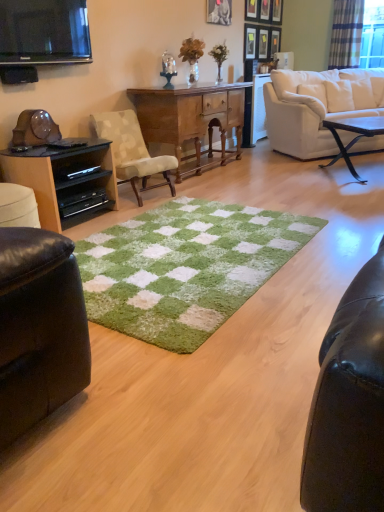
This screenshot has width=384, height=512. Describe the element at coordinates (277, 11) in the screenshot. I see `wooden picture frame at upper center, which is the 2th picture frame from right to left` at that location.

The image size is (384, 512). I want to click on wooden picture frame at upper center, which is the 2th picture frame from right to left, so click(277, 11).

This screenshot has width=384, height=512. Find the location of `wooden picture frame at upper center, placed as the third picture frame when sorted from right to left`. wooden picture frame at upper center, placed as the third picture frame when sorted from right to left is located at coordinates (263, 44).

Where is `beige fabric chair at center`? This screenshot has height=512, width=384. beige fabric chair at center is located at coordinates (131, 150).

What is the approximate width of beige fabric chair at center?

It is 22.84 inches.

What are the coordinates of `wooden picture frame at upper center, which is the 4th picture frame from right to left` in the screenshot? It's located at (265, 9).

Where is `wooden picture frame at upper center, which is the 2th picture frame from right to left`? The width and height of the screenshot is (384, 512). wooden picture frame at upper center, which is the 2th picture frame from right to left is located at coordinates (277, 11).

Is plaid fabric curtain at upper right shorter than metallic silver picture frame at upper center, the 1th picture frame in the right-to-left sequence?

In fact, plaid fabric curtain at upper right may be taller than metallic silver picture frame at upper center, the 1th picture frame in the right-to-left sequence.

From a real-world perspective, is plaid fabric curtain at upper right located higher than metallic silver picture frame at upper center, the seventh picture frame viewed from the left?

Correct, in the physical world, plaid fabric curtain at upper right is higher than metallic silver picture frame at upper center, the seventh picture frame viewed from the left.

Considering the sizes of objects plaid fabric curtain at upper right and metallic silver picture frame at upper center, the 1th picture frame in the right-to-left sequence, in the image provided, who is thinner, plaid fabric curtain at upper right or metallic silver picture frame at upper center, the 1th picture frame in the right-to-left sequence,?

Thinner between the two is metallic silver picture frame at upper center, the 1th picture frame in the right-to-left sequence.

Considering their positions, is plaid fabric curtain at upper right located in front of or behind metallic silver picture frame at upper center, the 1th picture frame in the right-to-left sequence?

Visually, plaid fabric curtain at upper right is located in front of metallic silver picture frame at upper center, the 1th picture frame in the right-to-left sequence.

From a real-world perspective, which object rests below the other?

green fuzzy vase at upper center, the 1th houseplant viewed from the right, is physically lower.

From the image's perspective, is metallic silver picture frame at upper center, the 1th picture frame in the right-to-left sequence, on green fuzzy vase at upper center, the 1th houseplant viewed from the right?

Yes, from the image's perspective, metallic silver picture frame at upper center, the 1th picture frame in the right-to-left sequence, is on top of green fuzzy vase at upper center, the 1th houseplant viewed from the right.

Is metallic silver picture frame at upper center, the 1th picture frame in the right-to-left sequence, not near green fuzzy vase at upper center, the second houseplant when ordered from left to right?

Indeed, metallic silver picture frame at upper center, the 1th picture frame in the right-to-left sequence, is not near green fuzzy vase at upper center, the second houseplant when ordered from left to right.

Consider the image. Between metallic silver picture frame at upper center, the 1th picture frame in the right-to-left sequence, and green fuzzy vase at upper center, the second houseplant when ordered from left to right, which one appears on the right side from the viewer's perspective?

From the viewer's perspective, metallic silver picture frame at upper center, the 1th picture frame in the right-to-left sequence, appears more on the right side.

In terms of width, does wooden picture frame at upper center, which is the 2th picture frame from right to left, look wider or thinner when compared to black glossy entertainment center at left?

Clearly, wooden picture frame at upper center, which is the 2th picture frame from right to left, has less width compared to black glossy entertainment center at left.

From the image's perspective, between wooden picture frame at upper center, which is the sixth picture frame from left to right, and black glossy entertainment center at left, which one is located above?

From the image's view, wooden picture frame at upper center, which is the sixth picture frame from left to right, is above.

Between wooden picture frame at upper center, which is the sixth picture frame from left to right, and black glossy entertainment center at left, which one has less height?

Standing shorter between the two is wooden picture frame at upper center, which is the sixth picture frame from left to right.

How many degrees apart are the facing directions of wooden picture frame at upper center, which is the 2th picture frame from right to left, and black glossy entertainment center at left?

The angular difference between wooden picture frame at upper center, which is the 2th picture frame from right to left, and black glossy entertainment center at left is 3.37 degrees.

Is beige fabric chair at center inside or outside of metallic silver picture frame at upper center, the first picture frame positioned from the left?

beige fabric chair at center cannot be found inside metallic silver picture frame at upper center, the first picture frame positioned from the left.

Could you measure the distance between beige fabric chair at center and metallic silver picture frame at upper center, the first picture frame positioned from the left?

The distance of beige fabric chair at center from metallic silver picture frame at upper center, the first picture frame positioned from the left, is 1.85 meters.

Is there a large distance between beige fabric chair at center and metallic silver picture frame at upper center, acting as the 7th picture frame starting from the right?

beige fabric chair at center is positioned a significant distance from metallic silver picture frame at upper center, acting as the 7th picture frame starting from the right.

Does beige fabric chair at center turn towards metallic silver picture frame at upper center, the first picture frame positioned from the left?

No, beige fabric chair at center is not turned towards metallic silver picture frame at upper center, the first picture frame positioned from the left.

From the image's perspective, is green fuzzy plant at upper center, which is the first houseplant in left-to-right order, located above flat screen tv at upper left?

Correct, green fuzzy plant at upper center, which is the first houseplant in left-to-right order, appears higher than flat screen tv at upper left in the image.

Can you tell me how much green fuzzy plant at upper center, the second houseplant when ordered from right to left, and flat screen tv at upper left differ in facing direction?

green fuzzy plant at upper center, the second houseplant when ordered from right to left, and flat screen tv at upper left are facing 2.01 degrees away from each other.

I want to click on the 1st houseplant above the flat screen tv at upper left (from the image's perspective), so click(192, 56).

Between point (274, 38) and point (260, 2), which one is positioned behind?

The point (274, 38) is farther.

Does metallic silver picture frame at upper center, the 1th picture frame in the right-to-left sequence, have a greater width compared to wooden picture frame at upper center, which is the 4th picture frame from right to left?

No, metallic silver picture frame at upper center, the 1th picture frame in the right-to-left sequence, is not wider than wooden picture frame at upper center, which is the 4th picture frame from right to left.

From a real-world perspective, who is located lower, metallic silver picture frame at upper center, the 1th picture frame in the right-to-left sequence, or wooden picture frame at upper center, which is the 4th picture frame from right to left?

From a 3D spatial view, metallic silver picture frame at upper center, the 1th picture frame in the right-to-left sequence, is below.

Would you say green fuzzy plant at upper center, which is the first houseplant in left-to-right order, is part of black glossy entertainment center at left's contents?

No, green fuzzy plant at upper center, which is the first houseplant in left-to-right order, is not surrounded by black glossy entertainment center at left.

From the image's perspective, is black glossy entertainment center at left below green fuzzy plant at upper center, the second houseplant when ordered from right to left?

Yes, from the image's perspective, black glossy entertainment center at left is beneath green fuzzy plant at upper center, the second houseplant when ordered from right to left.

Does black glossy entertainment center at left have a lesser width compared to green fuzzy plant at upper center, which is the first houseplant in left-to-right order?

No, black glossy entertainment center at left is not thinner than green fuzzy plant at upper center, which is the first houseplant in left-to-right order.

Is black glossy entertainment center at left oriented towards green fuzzy plant at upper center, the second houseplant when ordered from right to left?

No, black glossy entertainment center at left is not aimed at green fuzzy plant at upper center, the second houseplant when ordered from right to left.

Locate an element on the screen. picture frame that is the 1st object located above the plaid fabric curtain at upper right (from the image's perspective) is located at coordinates (275, 41).

Which houseplant is the 1st one when counting from the front of the metallic silver picture frame at upper center, the 1th picture frame in the right-to-left sequence? Please provide its 2D coordinates.

[(219, 57)]

Based on the photo, looking at the image, which one is located further to wooden picture frame at upper center, the fifth picture frame positioned from the left, wooden desk at center or metallic silver picture frame at upper center, acting as the 7th picture frame starting from the right?

wooden desk at center.

In the scene shown: From the image, which object appears to be farther from white fabric couch at upper right, wooden picture frame at upper center, placed as the third picture frame when sorted from right to left, or beige fabric chair at center?

Among the two, beige fabric chair at center is located further to white fabric couch at upper right.

From the image, which object appears to be farther from wooden desk at center, wooden picture frame at upper center, which is the 4th picture frame from right to left, or beige fabric chair at center?

wooden picture frame at upper center, which is the 4th picture frame from right to left, lies further to wooden desk at center than the other object.

Consider the image. From the image, which object appears to be farther from beige fabric chair at center, black metal coffee table at right or metallic silver picture frame at upper center, the first picture frame positioned from the left?

black metal coffee table at right lies further to beige fabric chair at center than the other object.

Considering their positions, is flat screen tv at upper left positioned further to green shaggy rug at center than wooden picture frame at upper center, the fifth picture frame positioned from the left?

Among the two, wooden picture frame at upper center, the fifth picture frame positioned from the left, is located further to green shaggy rug at center.

Looking at the image, which one is located closer to flat screen tv at upper left, green fuzzy vase at upper center, the 1th houseplant viewed from the right, or green fuzzy plant at upper center, the second houseplant when ordered from right to left?

green fuzzy plant at upper center, the second houseplant when ordered from right to left, is closer to flat screen tv at upper left.

From the image, which object appears to be nearer to metallic silver picture frame at upper center, which appears as the third picture frame when viewed from the left, wooden desk at center or white fabric couch at upper right?

Among the two, white fabric couch at upper right is located nearer to metallic silver picture frame at upper center, which appears as the third picture frame when viewed from the left.

Considering their positions, is metallic silver picture frame at upper center, the 1th picture frame in the right-to-left sequence, positioned further to flat screen tv at upper left than metallic silver picture frame at upper center, which is counted as the 5th picture frame, starting from the right?

metallic silver picture frame at upper center, the 1th picture frame in the right-to-left sequence.

You are a GUI agent. You are given a task and a screenshot of the screen. Output one action in this format:
    pyautogui.click(x=<x>, y=<y>)
    Task: Click on the chair between flat screen tv at upper left and black glossy entertainment center at left vertically
    
    Given the screenshot: What is the action you would take?
    pyautogui.click(x=131, y=150)

This screenshot has height=512, width=384. What are the coordinates of `curtain between wooden desk at center and wooden picture frame at upper center, which is the sixth picture frame from left to right, from front to back` in the screenshot? It's located at (346, 34).

Locate an element on the screen. studio couch between wooden picture frame at upper center, the sixth picture frame when ordered from right to left, and black metal coffee table at right in the up-down direction is located at coordinates (317, 106).

You are a GUI agent. You are given a task and a screenshot of the screen. Output one action in this format:
    pyautogui.click(x=<x>, y=<y>)
    Task: Click on the dresser between flat screen tv at upper left and wooden picture frame at upper center, placed as the third picture frame when sorted from right to left, along the z-axis
    
    Given the screenshot: What is the action you would take?
    pyautogui.click(x=65, y=181)